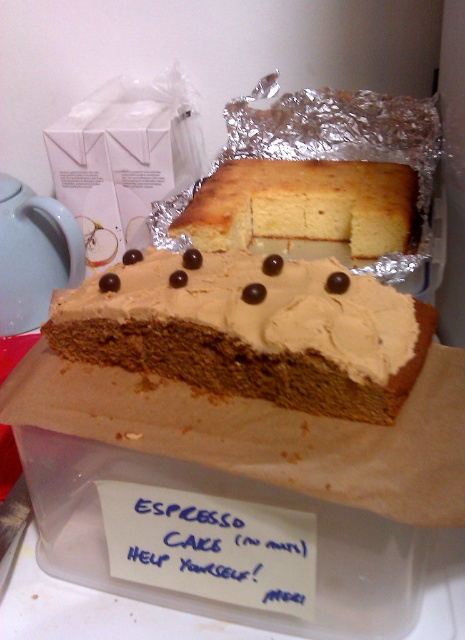
Question: Can you confirm if brown matte cake at center is positioned below matte white teapot at left?

Choices:
 (A) no
 (B) yes

Answer: (B)

Question: Among these points, which one is farthest from the camera?

Choices:
 (A) (99, 285)
 (B) (194, 198)
 (C) (12, 189)

Answer: (C)

Question: Among these objects, which one is nearest to the camera?

Choices:
 (A) yellow sponge cake at center
 (B) brown matte cake at center
 (C) matte white teapot at left

Answer: (B)

Question: Can you confirm if brown matte cake at center is positioned to the right of matte white teapot at left?

Choices:
 (A) yes
 (B) no

Answer: (A)

Question: Does yellow sponge cake at center appear over matte white teapot at left?

Choices:
 (A) yes
 (B) no

Answer: (A)

Question: Which object is the closest to the brown matte cake at center?

Choices:
 (A) matte white teapot at left
 (B) yellow sponge cake at center

Answer: (B)